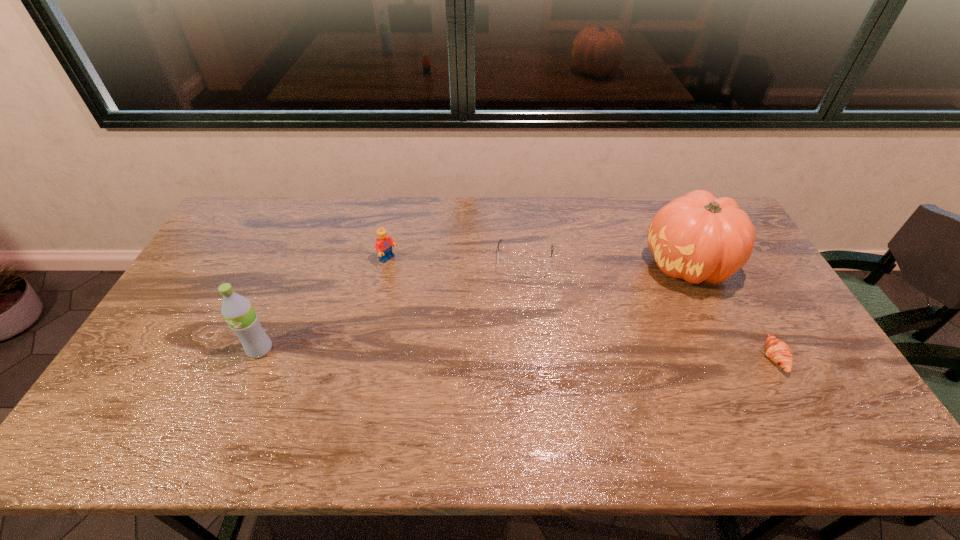
I want to click on the leftmost object, so click(237, 310).

I want to click on pastry, so click(778, 351).

Where is `the fourth tallest object`? This screenshot has height=540, width=960. the fourth tallest object is located at coordinates (510, 268).

You are a GUI agent. You are given a task and a screenshot of the screen. Output one action in this format:
    pyautogui.click(x=<x>, y=<y>)
    Task: Click on the spectacles
    The image size is (960, 540).
    Given the screenshot: What is the action you would take?
    pyautogui.click(x=510, y=268)

Find the location of `the fourth object from right to left`. the fourth object from right to left is located at coordinates (384, 242).

Find the location of a particular element. The width and height of the screenshot is (960, 540). Lego is located at coordinates (384, 242).

The width and height of the screenshot is (960, 540). Find the location of `pumpkin`. pumpkin is located at coordinates (697, 237).

Locate an element on the screen. The width and height of the screenshot is (960, 540). free space located on the left of the leftmost object is located at coordinates (152, 349).

Locate an element on the screen. The height and width of the screenshot is (540, 960). free space located on the front-facing side of the shortest object is located at coordinates (715, 357).

At what (x,y) coordinates should I click in order to perform the action: click on free region located on the front-facing side of the shortest object. Please return your answer as a coordinate pair (x, y). Looking at the image, I should click on (731, 357).